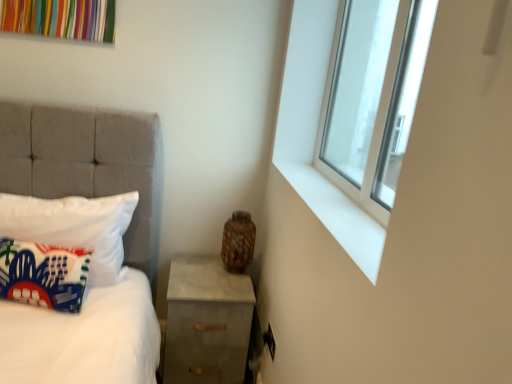
Question: Considering the relative positions of clear glass window at upper right and concrete nightstand at lower right in the image provided, is clear glass window at upper right to the right of concrete nightstand at lower right from the viewer's perspective?

Choices:
 (A) yes
 (B) no

Answer: (A)

Question: Is clear glass window at upper right closer to the viewer compared to concrete nightstand at lower right?

Choices:
 (A) yes
 (B) no

Answer: (A)

Question: Can you confirm if clear glass window at upper right is thinner than concrete nightstand at lower right?

Choices:
 (A) yes
 (B) no

Answer: (A)

Question: From a real-world perspective, is clear glass window at upper right located higher than concrete nightstand at lower right?

Choices:
 (A) no
 (B) yes

Answer: (B)

Question: Is clear glass window at upper right touching concrete nightstand at lower right?

Choices:
 (A) yes
 (B) no

Answer: (B)

Question: From the image's perspective, is printed fabric pillow at left, the second pillow when ordered from back to front, located above or below concrete nightstand at lower right?

Choices:
 (A) below
 (B) above

Answer: (B)

Question: Is printed fabric pillow at left, the second pillow when ordered from back to front, inside or outside of concrete nightstand at lower right?

Choices:
 (A) outside
 (B) inside

Answer: (A)

Question: In terms of width, does printed fabric pillow at left, which is the 1th pillow in front-to-back order, look wider or thinner when compared to concrete nightstand at lower right?

Choices:
 (A) thin
 (B) wide

Answer: (A)

Question: From a real-world perspective, relative to concrete nightstand at lower right, is printed fabric pillow at left, the second pillow when ordered from back to front, vertically above or below?

Choices:
 (A) above
 (B) below

Answer: (A)

Question: From a real-world perspective, is printed fabric pillow at left, which is the 1th pillow in front-to-back order, positioned above or below white smooth window sill at upper right?

Choices:
 (A) below
 (B) above

Answer: (A)

Question: Is printed fabric pillow at left, which is the 1th pillow in front-to-back order, inside or outside of white smooth window sill at upper right?

Choices:
 (A) outside
 (B) inside

Answer: (A)

Question: From the image's perspective, is printed fabric pillow at left, which is the 1th pillow in front-to-back order, positioned above or below white smooth window sill at upper right?

Choices:
 (A) above
 (B) below

Answer: (B)

Question: Is printed fabric pillow at left, which is the 1th pillow in front-to-back order, to the left or to the right of white smooth window sill at upper right in the image?

Choices:
 (A) right
 (B) left

Answer: (B)

Question: Looking at the image, does clear glass window at upper right seem bigger or smaller compared to white fabric pillow at left, arranged as the second pillow when viewed from the front?

Choices:
 (A) small
 (B) big

Answer: (A)

Question: From a real-world perspective, is clear glass window at upper right positioned above or below white fabric pillow at left, which is the 1th pillow from back to front?

Choices:
 (A) above
 (B) below

Answer: (A)